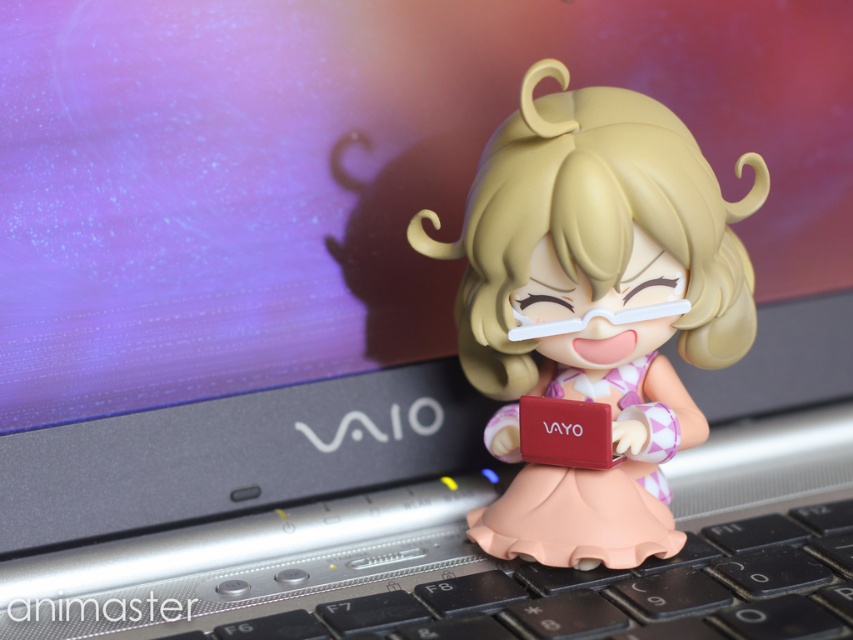
Question: Can you confirm if matte plastic figurine at center is positioned to the right of black plastic keyboard at lower center?

Choices:
 (A) yes
 (B) no

Answer: (A)

Question: Can you confirm if matte plastic figurine at center is wider than black plastic keyboard at lower center?

Choices:
 (A) no
 (B) yes

Answer: (A)

Question: Which point is farther to the camera?

Choices:
 (A) (561, 154)
 (B) (199, 637)

Answer: (A)

Question: Which object appears closest to the camera in this image?

Choices:
 (A) black plastic keyboard at lower center
 (B) matte plastic figurine at center

Answer: (A)

Question: Does matte plastic figurine at center have a larger size compared to black plastic keyboard at lower center?

Choices:
 (A) no
 (B) yes

Answer: (B)